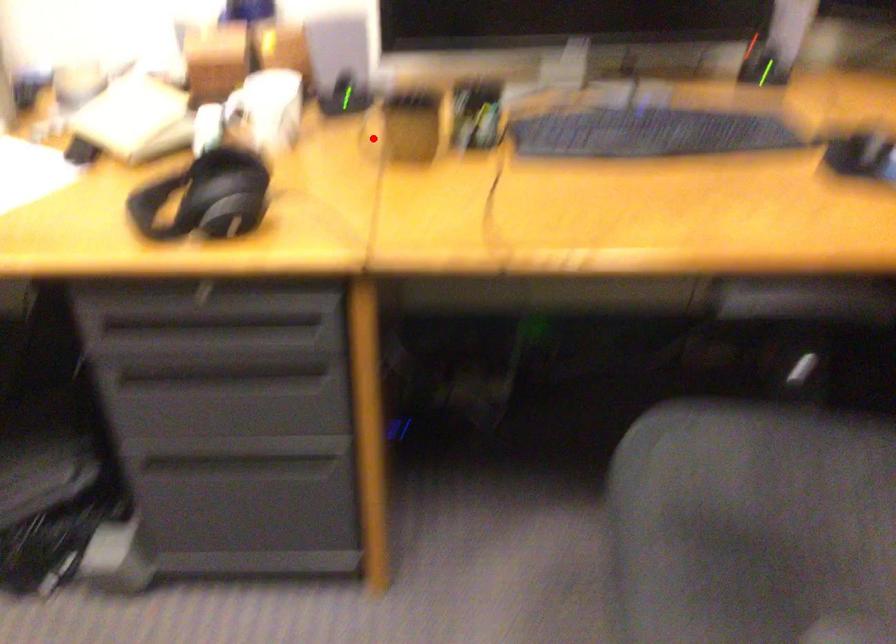
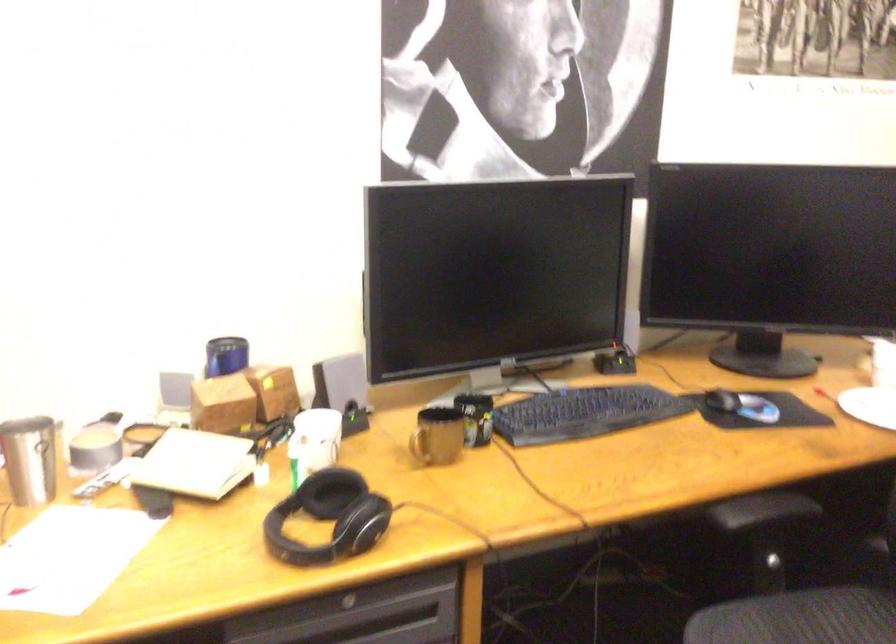
Question: A red point is marked in image1. In image2, is the corresponding 3D point closer to the camera or farther? Reply with the corresponding letter.

Choices:
 (A) The corresponding 3D point is closer.
 (B) The corresponding 3D point is farther.

Answer: (B)